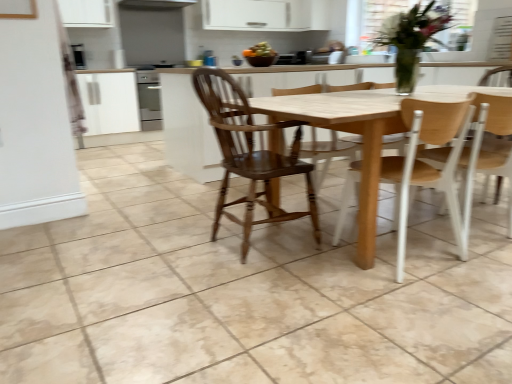
Find the location of a particular element. The width and height of the screenshot is (512, 384). vacant space that's between light wood table at center and wooden chair at center, which appears as the 3th chair when viewed from the right is located at coordinates (265, 272).